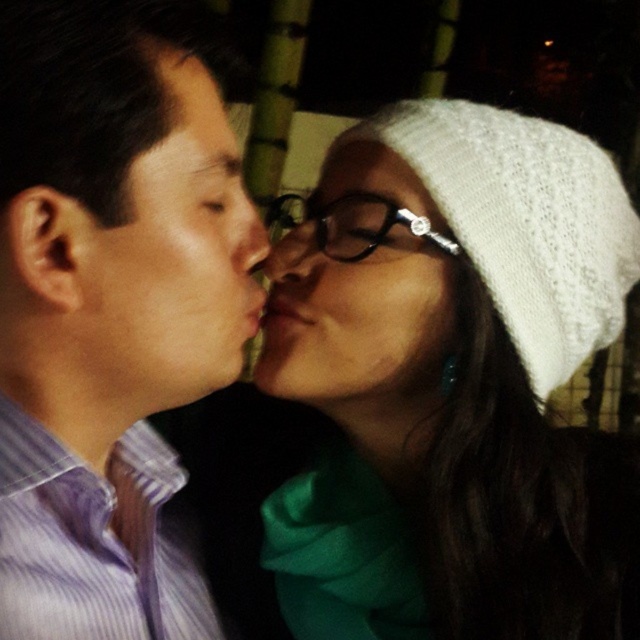
Question: Estimate the real-world distances between objects in this image. Which object is closer to the purple striped shirt at left?

Choices:
 (A) matte purple shirt at left
 (B) matte black nose at center

Answer: (A)

Question: Is white knitted hat at upper right closer to camera compared to smooth skin nose at center?

Choices:
 (A) no
 (B) yes

Answer: (A)

Question: Estimate the real-world distances between objects in this image. Which object is closer to the white knitted hat at upper right?

Choices:
 (A) matte black nose at center
 (B) smooth skin nose at center
 (C) purple striped shirt at left
 (D) white knitted hat at center

Answer: (D)

Question: Can you confirm if matte purple shirt at left is wider than white knitted hat at center?

Choices:
 (A) no
 (B) yes

Answer: (A)

Question: Which of the following is the closest to the observer?

Choices:
 (A) (307, 257)
 (B) (262, 259)

Answer: (B)

Question: Does white knitted hat at upper right have a larger size compared to white knitted hat at center?

Choices:
 (A) yes
 (B) no

Answer: (A)